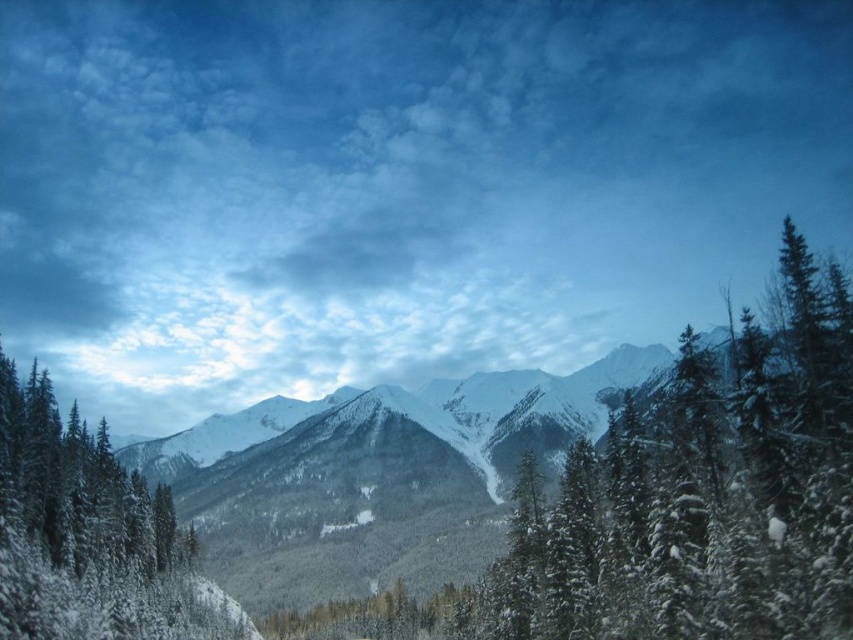
Is snow-covered evergreen at center to the right of snow-covered evergreen at left from the viewer's perspective?

Indeed, snow-covered evergreen at center is positioned on the right side of snow-covered evergreen at left.

Who is positioned more to the left, snow-covered evergreen at center or snow-covered evergreen at left?

From the viewer's perspective, snow-covered evergreen at left appears more on the left side.

Who is more distant from viewer, (788, 547) or (102, 440)?

Point (102, 440)

Locate an element on the screen. Image resolution: width=853 pixels, height=640 pixels. snow-covered evergreen at center is located at coordinates (701, 497).